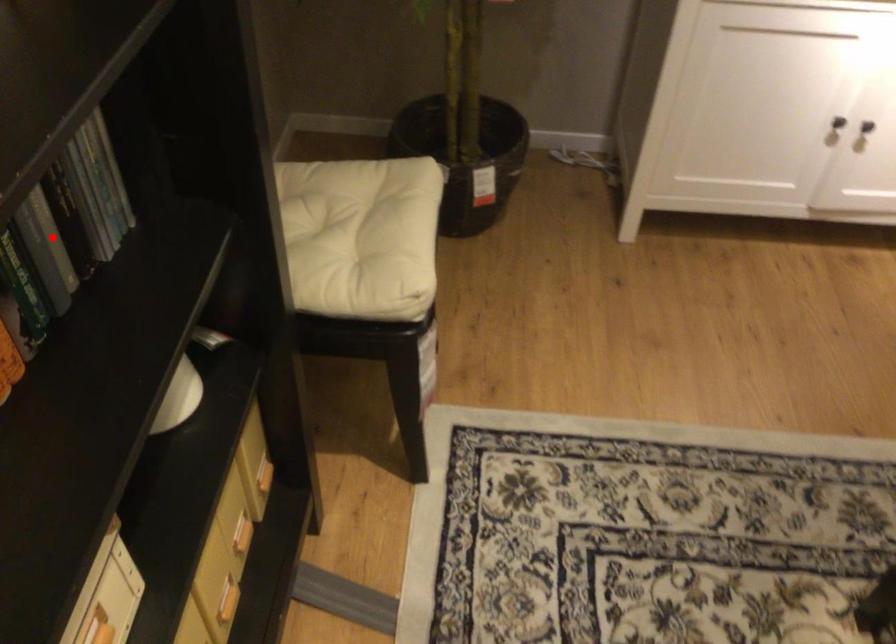
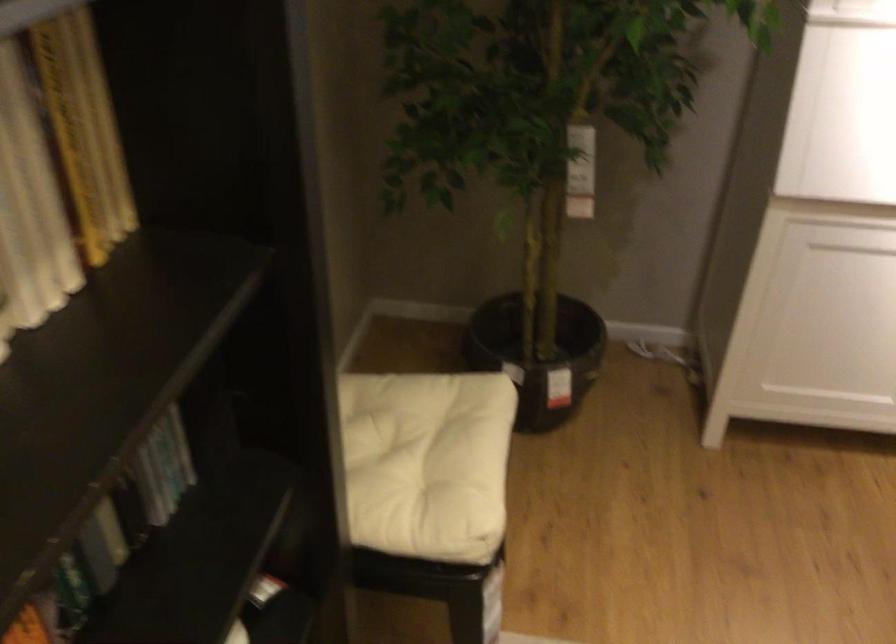
Question: I am providing you with two images of the same scene from different viewpoints. A red point is marked on the first image. At the location where the point appears in image 1, is it still visible in image 2?

Choices:
 (A) Yes
 (B) No

Answer: (B)